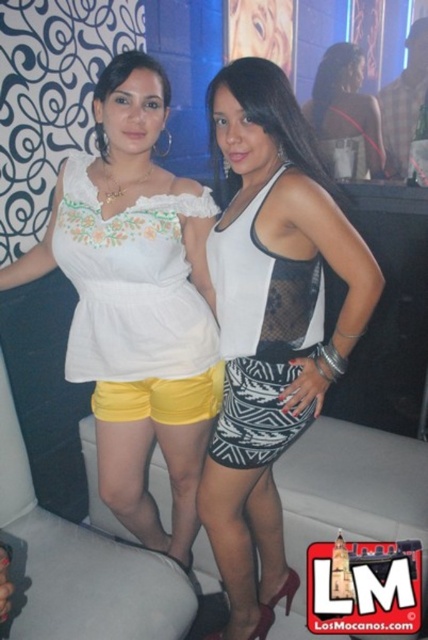
Is matte white blouse at center positioned in front of matte black dress at center?

Answer: Yes, matte white blouse at center is in front of matte black dress at center.

Who is more distant from viewer, (198, 314) or (330, 161)?

The point (330, 161) is behind.

I want to click on matte white blouse at center, so pos(136,301).

Locate an element on the screen. This screenshot has width=428, height=640. matte white blouse at center is located at coordinates (136, 301).

Can you confirm if matte white blouse at center is taller than yellow fabric shorts at lower center?

Yes.

This screenshot has height=640, width=428. What are the coordinates of `matte white blouse at center` in the screenshot? It's located at [x=136, y=301].

Between point (118, 428) and point (118, 280), which one is positioned in front?

Point (118, 280) is in front.

Does point (130, 77) come farther from viewer compared to point (187, 342)?

No, it is not.

The image size is (428, 640). Find the location of `matte white blouse at center`. matte white blouse at center is located at coordinates (136, 301).